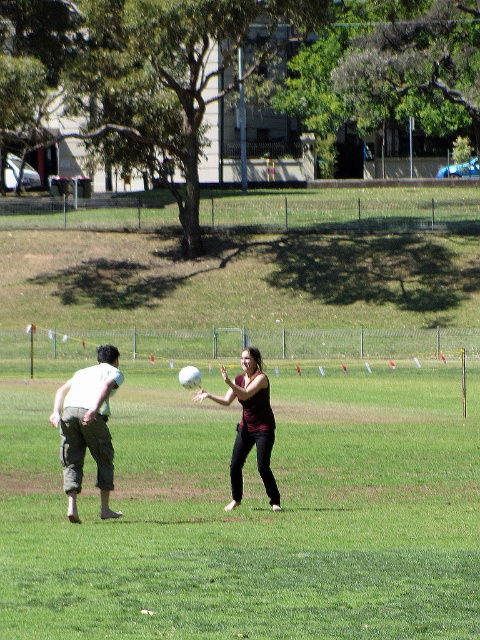
You are a photographer trying to capture the perfect shot of the two people playing catch. You notice the white matte ball at center and the light green cotton shirt at left. Which object should you focus on if you want to capture the larger subject in your frame?

The white matte ball at center is larger in size than the light green cotton shirt at left, so focusing on the white matte ball at center will capture the larger subject.

You are a photographer trying to capture a photo of the two people in the scene. You want to ensure that both the light green cotton shirt at left and the matte black shirt at center are clearly visible in the frame. Based on their positions, which shirt should you focus on first to ensure proper focus and composition?

Since the light green cotton shirt at left is positioned to the left of the matte black shirt at center, you should focus on the matte black shirt at center first as it is closer to the center of the frame, ensuring better focus and composition for both subjects.